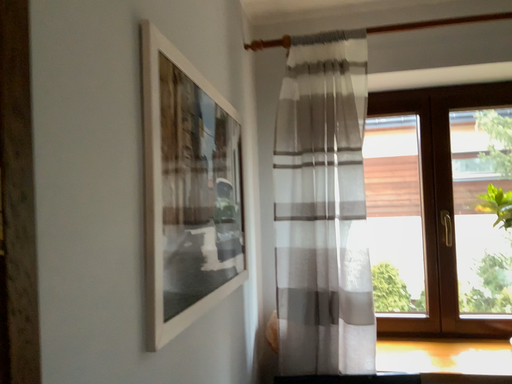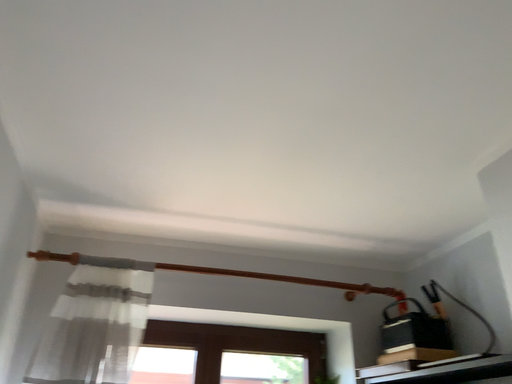
Question: How did the camera likely rotate when shooting the video?

Choices:
 (A) rotated left
 (B) rotated right

Answer: (B)